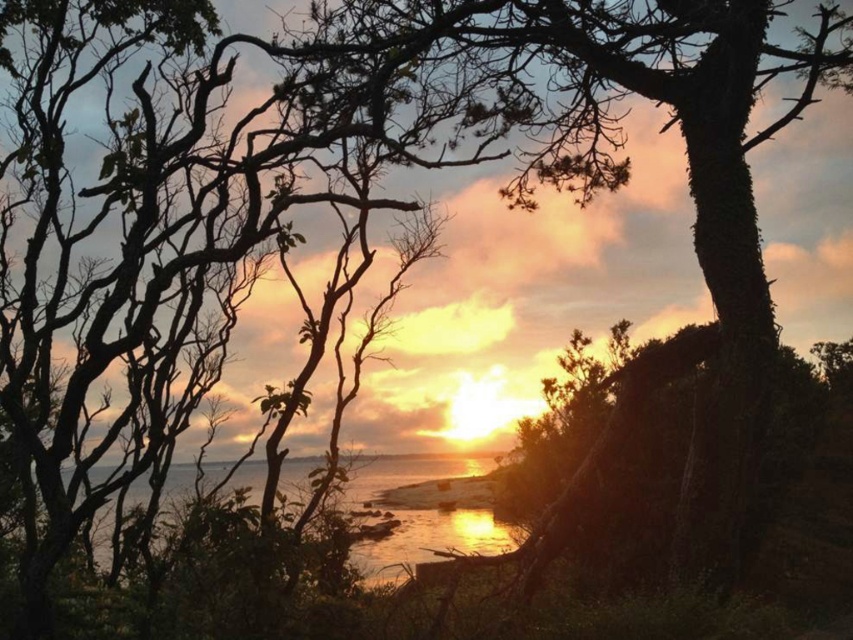
Question: Which point is closer to the camera taking this photo?

Choices:
 (A) (758, 288)
 (B) (352, 548)

Answer: (A)

Question: Which of the following is the farthest from the observer?

Choices:
 (A) green mossy tree at center
 (B) shiny metallic water at center

Answer: (B)

Question: Can you confirm if green mossy tree at center is positioned to the right of shiny metallic water at center?

Choices:
 (A) yes
 (B) no

Answer: (A)

Question: Is green mossy tree at center to the left of shiny metallic water at center from the viewer's perspective?

Choices:
 (A) no
 (B) yes

Answer: (A)

Question: Does green mossy tree at center lie behind shiny metallic water at center?

Choices:
 (A) yes
 (B) no

Answer: (B)